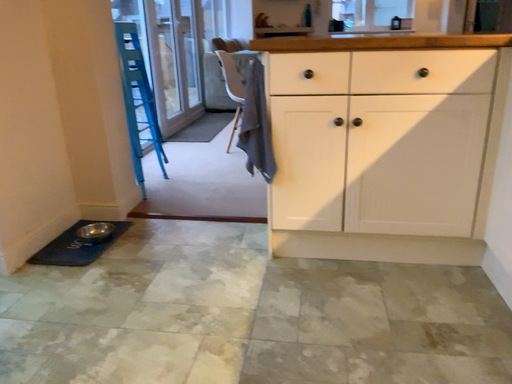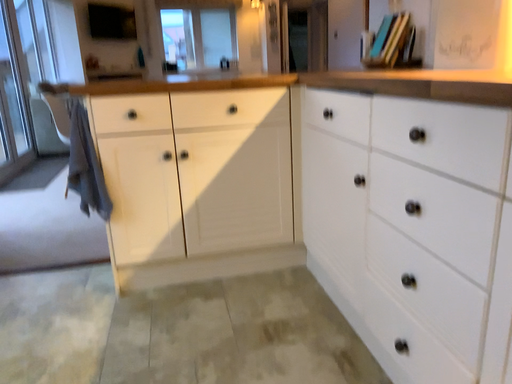
Question: How did the camera likely rotate when shooting the video?

Choices:
 (A) rotated right
 (B) rotated left

Answer: (A)